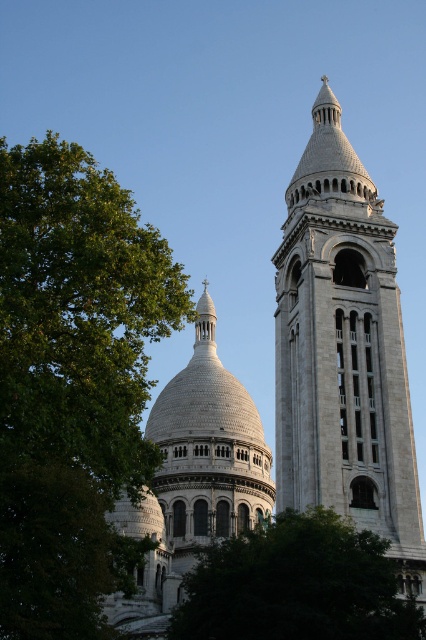
Question: Estimate the real-world distances between objects in this image. Which object is farther from the white stone tower at upper center?

Choices:
 (A) green leafy tree at left
 (B) white stone dome at center

Answer: (B)

Question: Considering the relative positions of white stone church at center and white stone dome at center in the image provided, where is white stone church at center located with respect to white stone dome at center?

Choices:
 (A) above
 (B) below

Answer: (A)

Question: Where is green leafy tree at left located in relation to green leafy tree at lower center in the image?

Choices:
 (A) above
 (B) below

Answer: (A)

Question: Which of the following is the closest to the observer?

Choices:
 (A) white stone dome at center
 (B) white stone church at center
 (C) green leafy tree at lower center

Answer: (C)

Question: Which of the following is the closest to the observer?

Choices:
 (A) (362, 476)
 (B) (161, 586)
 (C) (46, 216)
 (D) (412, 467)

Answer: (C)

Question: Does green leafy tree at left have a larger size compared to white stone tower at upper center?

Choices:
 (A) no
 (B) yes

Answer: (B)